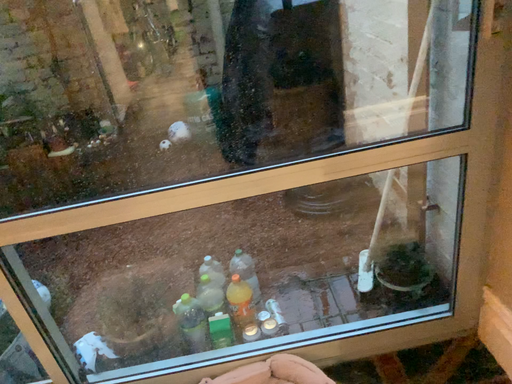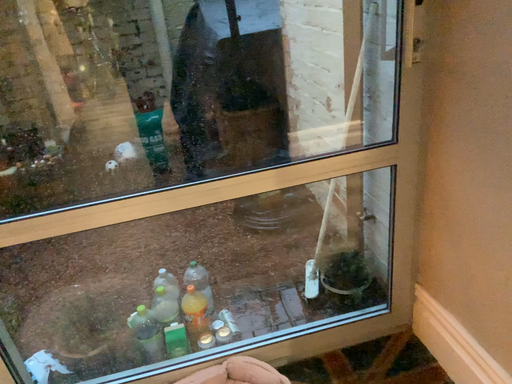
Question: How did the camera likely rotate when shooting the video?

Choices:
 (A) rotated left
 (B) rotated right

Answer: (B)